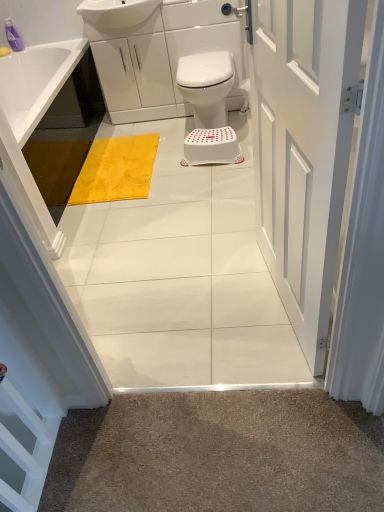
Locate an element on the screen. free space to the left of white painted wood door at center is located at coordinates (200, 307).